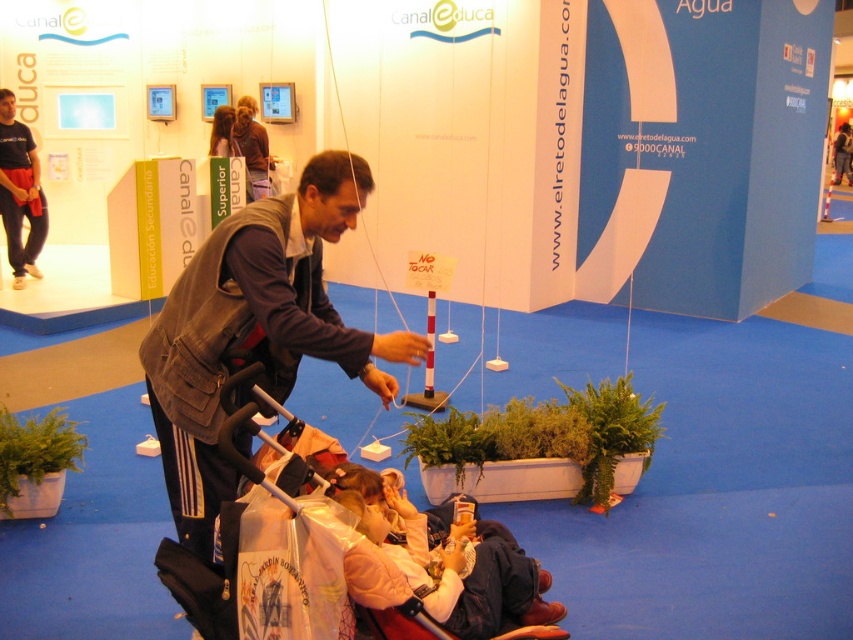
Can you confirm if black plastic baby carriage at lower center is positioned above brown leather jacket at upper center?

No.

Can you confirm if black plastic baby carriage at lower center is taller than brown leather jacket at upper center?

In fact, black plastic baby carriage at lower center may be shorter than brown leather jacket at upper center.

Identify the location of black plastic baby carriage at lower center. The width and height of the screenshot is (853, 640). (206, 577).

Which of these two, black plastic baby carriage at lower center or matte black pants at left, stands shorter?

Standing shorter between the two is black plastic baby carriage at lower center.

The width and height of the screenshot is (853, 640). What do you see at coordinates (206, 577) in the screenshot? I see `black plastic baby carriage at lower center` at bounding box center [206, 577].

This screenshot has height=640, width=853. I want to click on black plastic baby carriage at lower center, so click(x=206, y=577).

Does light pink fabric at lower center have a lesser height compared to brown leather jacket at upper center?

Correct, light pink fabric at lower center is not as tall as brown leather jacket at upper center.

Is point (550, 634) positioned before point (264, 152)?

That is True.

Is point (497, 557) farther from camera compared to point (231, 132)?

No, it is in front of (231, 132).

The width and height of the screenshot is (853, 640). Identify the location of light pink fabric at lower center. (450, 564).